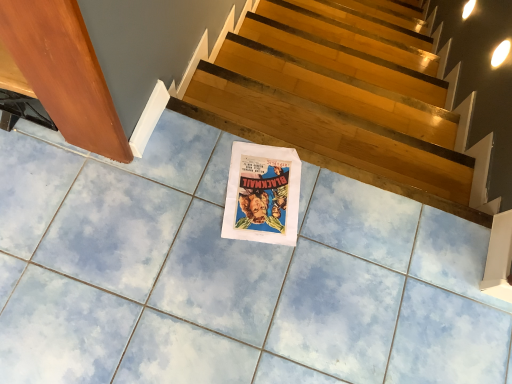
Question: Is wooden at upper center wider or thinner than white paper at center?

Choices:
 (A) wide
 (B) thin

Answer: (B)

Question: In the image, is wooden at upper center positioned in front of or behind white paper at center?

Choices:
 (A) behind
 (B) front

Answer: (A)

Question: From a real-world perspective, is wooden at upper center positioned above or below white paper at center?

Choices:
 (A) below
 (B) above

Answer: (A)

Question: From a real-world perspective, relative to wooden at upper center, is white paper at center vertically above or below?

Choices:
 (A) above
 (B) below

Answer: (A)

Question: Is white paper at center wider or thinner than wooden at upper center?

Choices:
 (A) thin
 (B) wide

Answer: (B)

Question: In the image, is white paper at center positioned in front of or behind wooden at upper center?

Choices:
 (A) behind
 (B) front

Answer: (B)

Question: From the image's perspective, is white paper at center above or below wooden at upper center?

Choices:
 (A) above
 (B) below

Answer: (B)